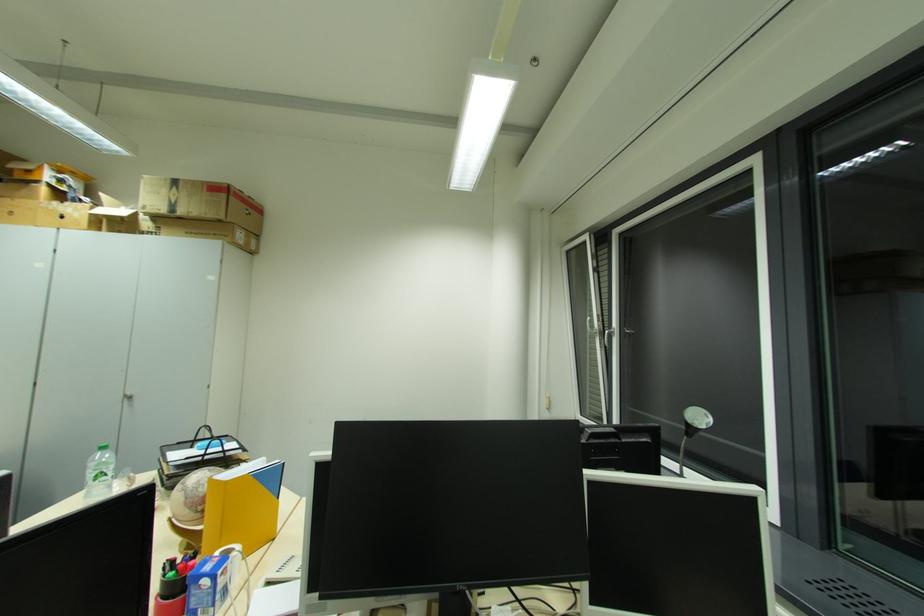
The height and width of the screenshot is (616, 924). What are the coordinates of `small blue box` in the screenshot? It's located at (211, 585).